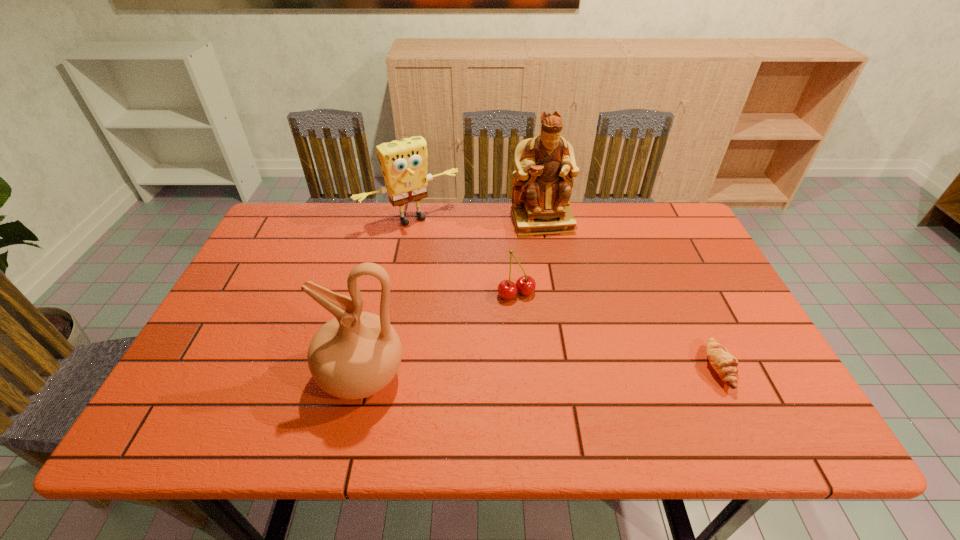
Locate an element on the screen. The width and height of the screenshot is (960, 540). pottery is located at coordinates click(356, 354).

Where is `the shortest object`? The image size is (960, 540). the shortest object is located at coordinates (725, 364).

At what (x,y) coordinates should I click in order to perform the action: click on pastry. Please return your answer as a coordinate pair (x, y). This screenshot has width=960, height=540. Looking at the image, I should click on (725, 364).

This screenshot has width=960, height=540. I want to click on cherry, so click(525, 285).

Locate an element on the screen. the second shortest object is located at coordinates (525, 285).

In order to click on the third tallest object in this screenshot , I will do `click(403, 163)`.

Where is `figurine`? The image size is (960, 540). figurine is located at coordinates pyautogui.click(x=545, y=165).

I want to click on free spot located 0.190m on the spout of the pottery, so click(234, 376).

At what (x,y) coordinates should I click in order to perform the action: click on free space located on the spout of the pottery. Please return your answer as a coordinate pair (x, y). Looking at the image, I should click on (199, 376).

I want to click on free location located 0.190m on the spout of the pottery, so click(234, 376).